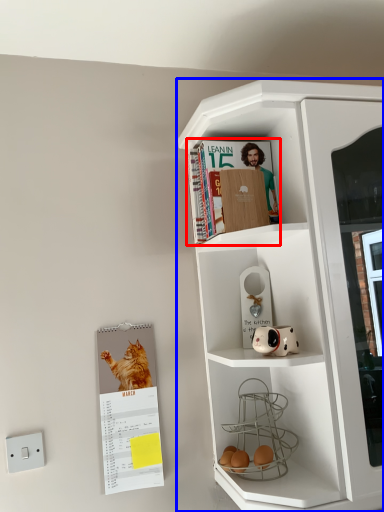
Question: Which point is further to the camera, magazine (highlighted by a red box) or cupboard (highlighted by a blue box)?

Choices:
 (A) magazine
 (B) cupboard

Answer: (A)